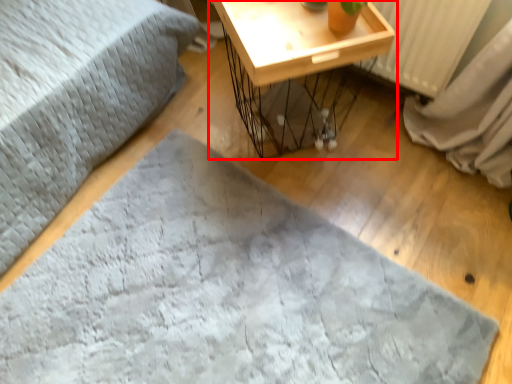
Question: From the image's perspective, what is the correct spatial positioning of table (annotated by the red box) in reference to sheet?

Choices:
 (A) below
 (B) above

Answer: (B)